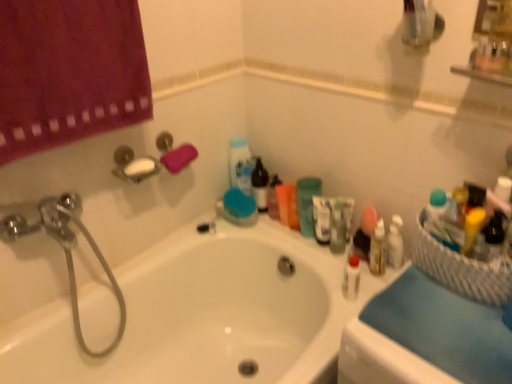
Question: Does chrome metallic showerhead at upper left have a smaller size compared to blue fabric at right?

Choices:
 (A) no
 (B) yes

Answer: (A)

Question: Considering the relative sizes of chrome metallic showerhead at upper left and blue fabric at right in the image provided, is chrome metallic showerhead at upper left thinner than blue fabric at right?

Choices:
 (A) no
 (B) yes

Answer: (B)

Question: Considering the relative positions of chrome metallic showerhead at upper left and blue fabric at right in the image provided, is chrome metallic showerhead at upper left in front of blue fabric at right?

Choices:
 (A) yes
 (B) no

Answer: (B)

Question: Considering the relative sizes of chrome metallic showerhead at upper left and blue fabric at right in the image provided, is chrome metallic showerhead at upper left bigger than blue fabric at right?

Choices:
 (A) no
 (B) yes

Answer: (B)

Question: Is chrome metallic showerhead at upper left turned away from blue fabric at right?

Choices:
 (A) no
 (B) yes

Answer: (A)

Question: In terms of size, does green matte cup at upper center appear bigger or smaller than white glossy bathtub at center?

Choices:
 (A) big
 (B) small

Answer: (B)

Question: Is green matte cup at upper center taller or shorter than white glossy bathtub at center?

Choices:
 (A) tall
 (B) short

Answer: (B)

Question: In terms of width, does green matte cup at upper center look wider or thinner when compared to white glossy bathtub at center?

Choices:
 (A) wide
 (B) thin

Answer: (B)

Question: Considering the relative positions of green matte cup at upper center and white glossy bathtub at center in the image provided, is green matte cup at upper center to the left or to the right of white glossy bathtub at center?

Choices:
 (A) right
 (B) left

Answer: (A)

Question: Do you think pink sponge at upper left is within green matte cup at upper center, or outside of it?

Choices:
 (A) inside
 (B) outside

Answer: (B)

Question: Considering the positions of pink sponge at upper left and green matte cup at upper center in the image, is pink sponge at upper left bigger or smaller than green matte cup at upper center?

Choices:
 (A) big
 (B) small

Answer: (B)

Question: In the image, is pink sponge at upper left positioned in front of or behind green matte cup at upper center?

Choices:
 (A) front
 (B) behind

Answer: (A)

Question: Is point (179, 158) positioned closer to the camera than point (311, 193)?

Choices:
 (A) closer
 (B) farther

Answer: (A)

Question: Looking at the image, does green matte cup at upper center seem bigger or smaller compared to blue fabric at right?

Choices:
 (A) big
 (B) small

Answer: (B)

Question: Is green matte cup at upper center wider or thinner than blue fabric at right?

Choices:
 (A) wide
 (B) thin

Answer: (B)